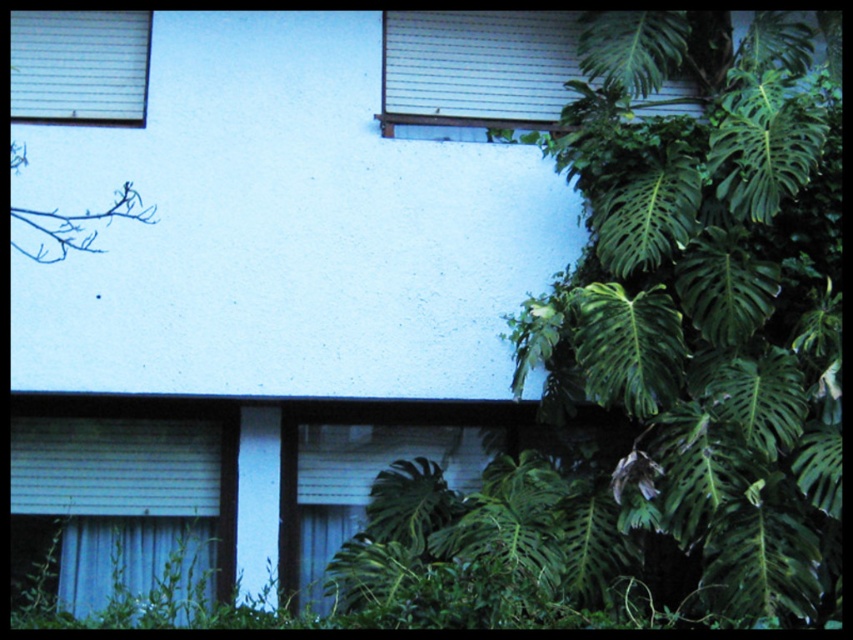
Question: Considering the relative positions of white textured window at upper center and blue fabric curtain at lower left in the image provided, where is white textured window at upper center located with respect to blue fabric curtain at lower left?

Choices:
 (A) left
 (B) right

Answer: (B)

Question: Which of the following is the farthest from the observer?

Choices:
 (A) (500, 33)
 (B) (84, 83)
 (C) (206, 570)

Answer: (A)

Question: Where is white matte window at upper left located in relation to blue fabric curtain at lower left in the image?

Choices:
 (A) above
 (B) below

Answer: (A)

Question: Which object is the closest to the white textured window at upper center?

Choices:
 (A) white matte window at upper left
 (B) blue fabric curtain at lower left

Answer: (A)

Question: Estimate the real-world distances between objects in this image. Which object is farther from the white matte window at upper left?

Choices:
 (A) blue fabric curtain at lower left
 (B) white textured window at upper center

Answer: (A)

Question: Does white textured window at upper center have a lesser width compared to blue fabric curtain at lower left?

Choices:
 (A) yes
 (B) no

Answer: (B)